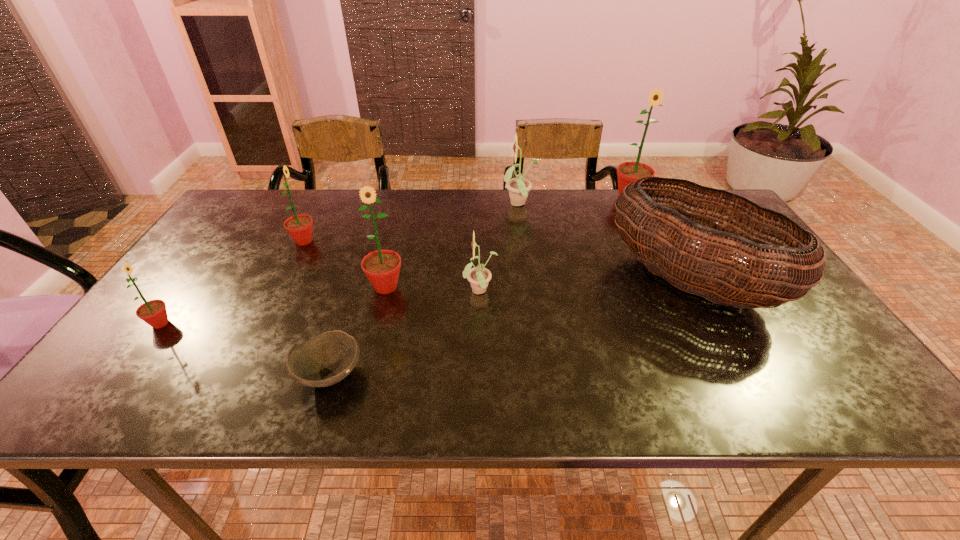
At what (x,y) coordinates should I click in order to perform the action: click on the biggest green sunflower. Please return your answer as a coordinate pair (x, y). This screenshot has height=540, width=960. Looking at the image, I should click on (628, 172).

You are a GUI agent. You are given a task and a screenshot of the screen. Output one action in this format:
    pyautogui.click(x=<x>, y=<y>)
    Task: Click on the rightmost sunflower
    
    Given the screenshot: What is the action you would take?
    pyautogui.click(x=628, y=172)

What are the coordinates of `the third farthest green sunflower` in the screenshot? It's located at (382, 267).

Locate an element on the screen. Image resolution: width=960 pixels, height=540 pixels. the third smallest green sunflower is located at coordinates coord(382,267).

Where is `the bigger yellow sunflower`? the bigger yellow sunflower is located at coordinates (518, 187).

This screenshot has width=960, height=540. Find the location of `the sixth object from left to right`. the sixth object from left to right is located at coordinates (518, 187).

Identify the location of the third farthest sunflower. This screenshot has width=960, height=540. (299, 227).

Locate an element on the screen. the third biggest green sunflower is located at coordinates (299, 227).

The image size is (960, 540). In order to click on brown basket in this screenshot , I will do `click(789, 278)`.

Find the location of `the fourth object from right to left`. the fourth object from right to left is located at coordinates (479, 276).